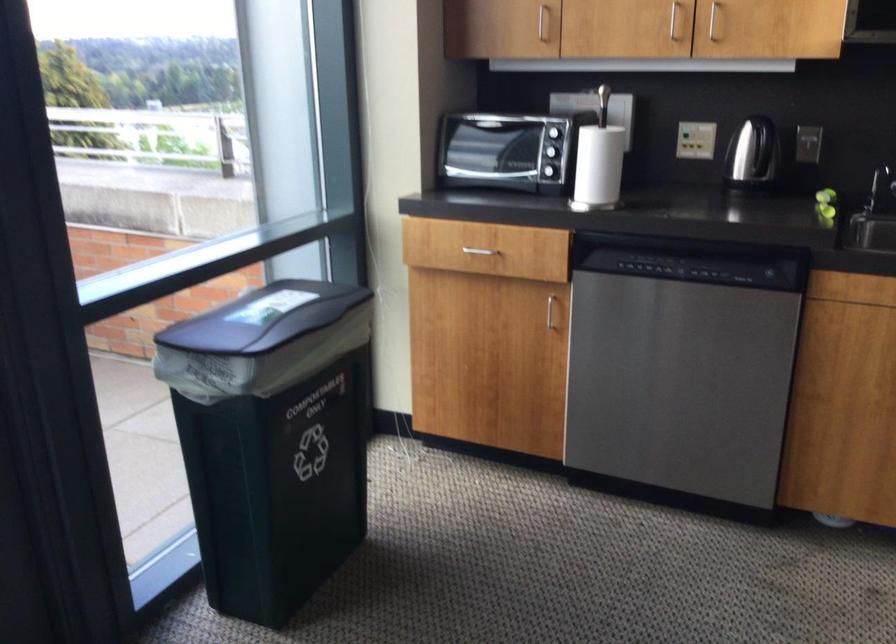
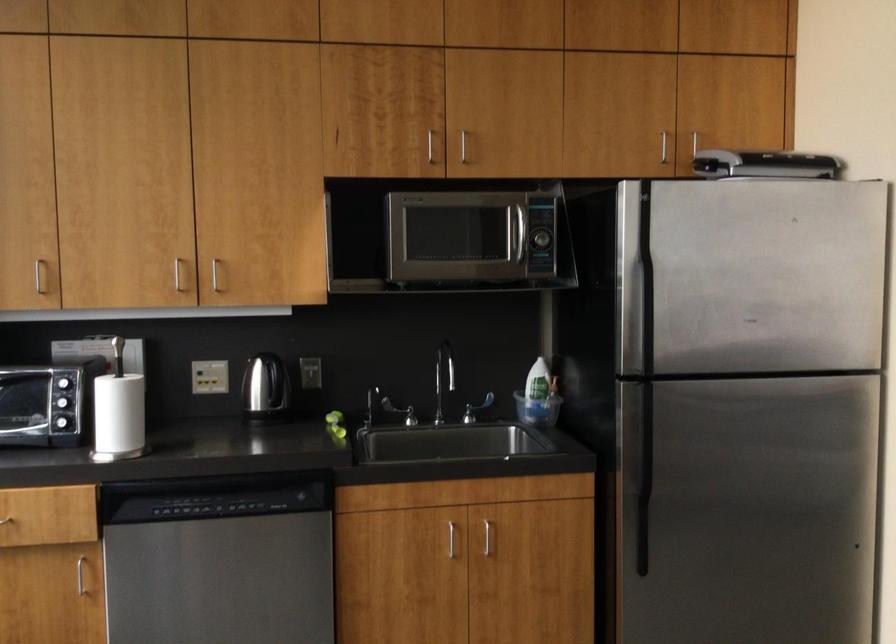
Question: How did the camera likely rotate?

Choices:
 (A) Left
 (B) Right
 (C) Up
 (D) Down

Answer: (B)